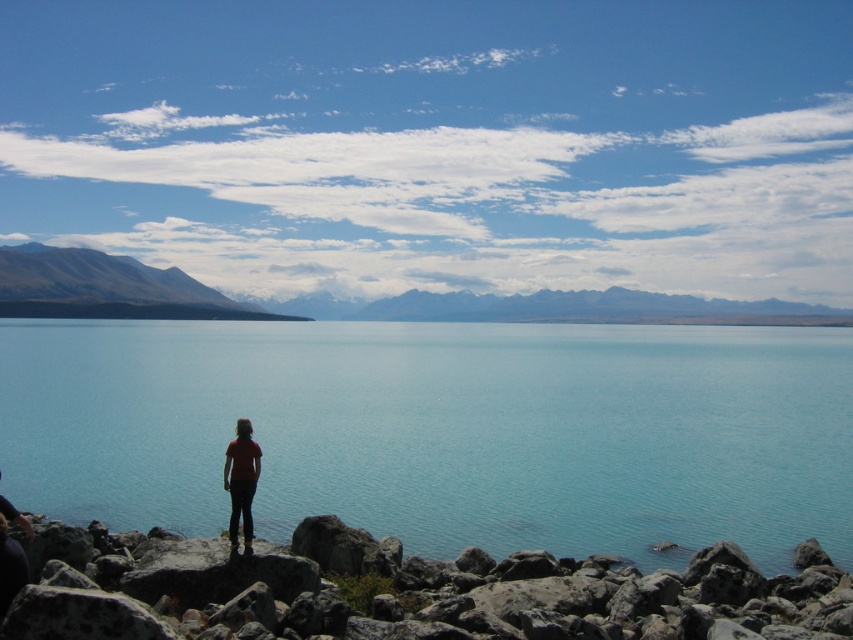
You are a photographer planning to capture the clear blue water at center and the snowy rocky mountain at left in a single shot. Based on their heights, which object should you focus on first to ensure both are in frame?

The clear blue water at center has a lesser height compared to the snowy rocky mountain at left. To ensure both are in frame, focus on the snowy rocky mountain at left first since it is taller and requires more space in the composition.

You are a photographer planning to take a landscape photo that includes both the clear blue water at center and the snowy rocky mountain at left. Based on their positions, will the mountain appear smaller than the water in the photo?

Yes, the snowy rocky mountain at left is behind the clear blue water at center, so it will appear smaller in the photo compared to the water.